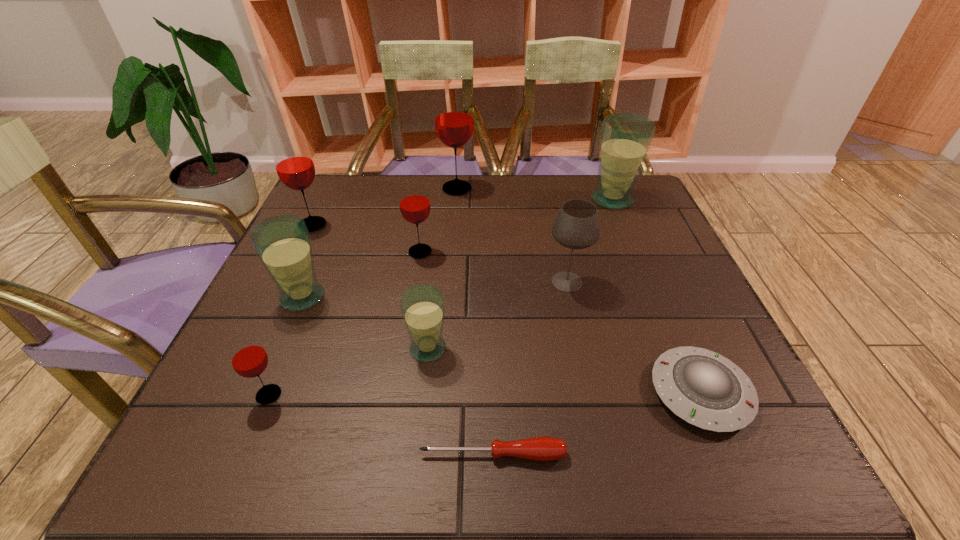
Where is `object that is the seventh closest to the second biggest blue glass`? object that is the seventh closest to the second biggest blue glass is located at coordinates (576, 226).

Locate which object ranks ninth in proximity to the red screwdriver. Please provide its 2D coordinates. Your answer should be formatted as a tuple, i.e. [(x, y)], where the tuple contains the x and y coordinates of a point satisfying the conditions above.

[(453, 118)]

I want to click on glass that stands as the sixth closest to the second smallest blue glass, so click(625, 138).

Find the location of a particular element. The image size is (960, 540). glass that is the fifth closest to the rightmost glass is located at coordinates (294, 165).

Locate which red glass ranks fourth in proximity to the shortest object. Please provide its 2D coordinates. Your answer should be formatted as a tuple, i.e. [(x, y)], where the tuple contains the x and y coordinates of a point satisfying the conditions above.

[(453, 118)]

Where is `red glass identified as the second closest to the rightmost glass`? Image resolution: width=960 pixels, height=540 pixels. red glass identified as the second closest to the rightmost glass is located at coordinates (414, 202).

Identify which blue glass is the nearest to the nearest blue glass. Please provide its 2D coordinates. Your answer should be formatted as a tuple, i.e. [(x, y)], where the tuple contains the x and y coordinates of a point satisfying the conditions above.

[(282, 243)]

Point out which blue glass is positioned as the nearest to the second shortest object. Please provide its 2D coordinates. Your answer should be formatted as a tuple, i.e. [(x, y)], where the tuple contains the x and y coordinates of a point satisfying the conditions above.

[(422, 306)]

Identify the location of free space that satisfies the following two spatial constraints: 1. on the front side of the nearest object; 2. on the left side of the eighth nearest object. This screenshot has width=960, height=540. (202, 454).

I want to click on free space that satisfies the following two spatial constraints: 1. on the front side of the nearest object; 2. on the left side of the leftmost blue glass, so click(x=235, y=454).